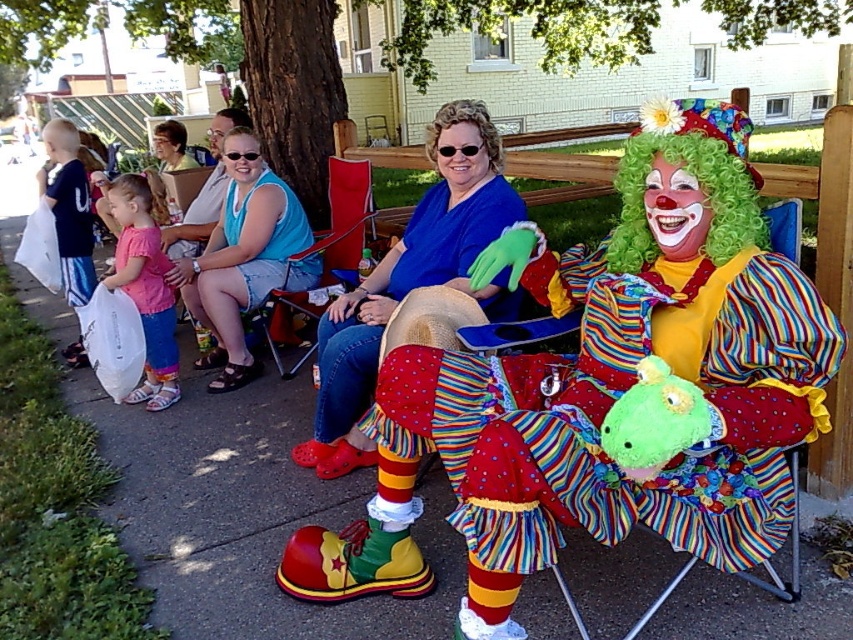
Question: Which point is closer to the camera taking this photo?

Choices:
 (A) (480, 120)
 (B) (363, 196)
 (C) (236, 321)

Answer: (A)

Question: Is blue denim shorts at center wider than red fabric chair at center?

Choices:
 (A) no
 (B) yes

Answer: (B)

Question: Which of these objects is positioned farthest from the blue denim shorts at center?

Choices:
 (A) pink fabric dress at left
 (B) red fabric chair at center
 (C) blue cotton shirt at center

Answer: (C)

Question: Which point is farther to the camera?

Choices:
 (A) multicolored striped clown at center
 (B) red fabric chair at center
 (C) blue cotton shirt at center
 (D) pink fabric dress at left

Answer: (B)

Question: Does blue denim shorts at center appear on the left side of red fabric chair at center?

Choices:
 (A) yes
 (B) no

Answer: (A)

Question: Is blue denim shorts at center thinner than red fabric chair at center?

Choices:
 (A) no
 (B) yes

Answer: (A)